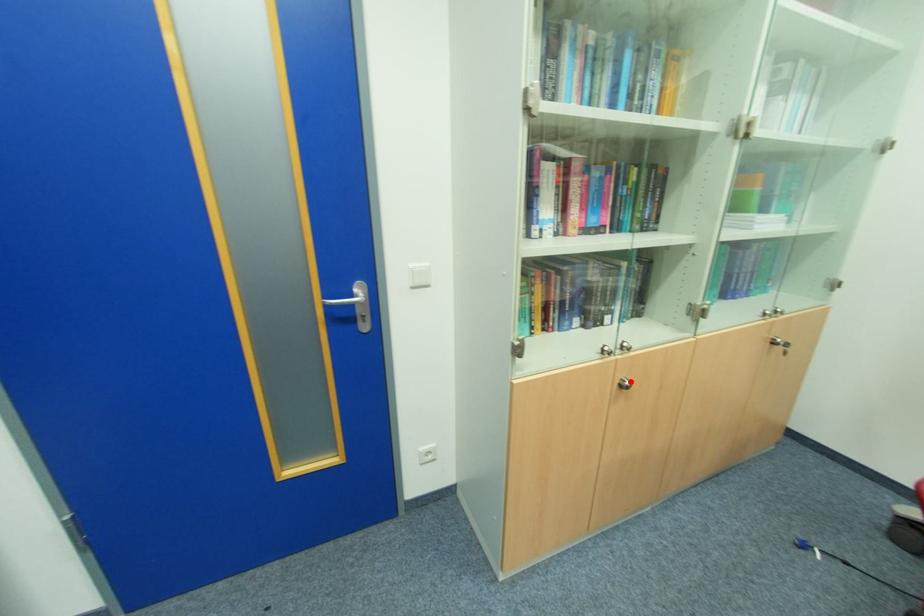
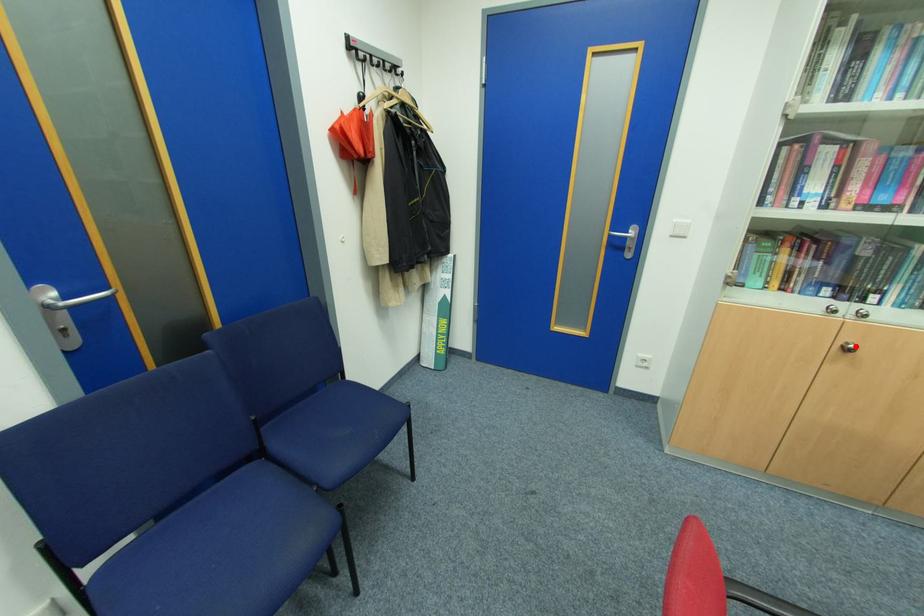
I am providing you with two images of the same scene from different viewpoints. A red point is marked on the first image and another point is marked on the second image. Are the points marked in image1 and image2 representing the same 3D position?

Yes